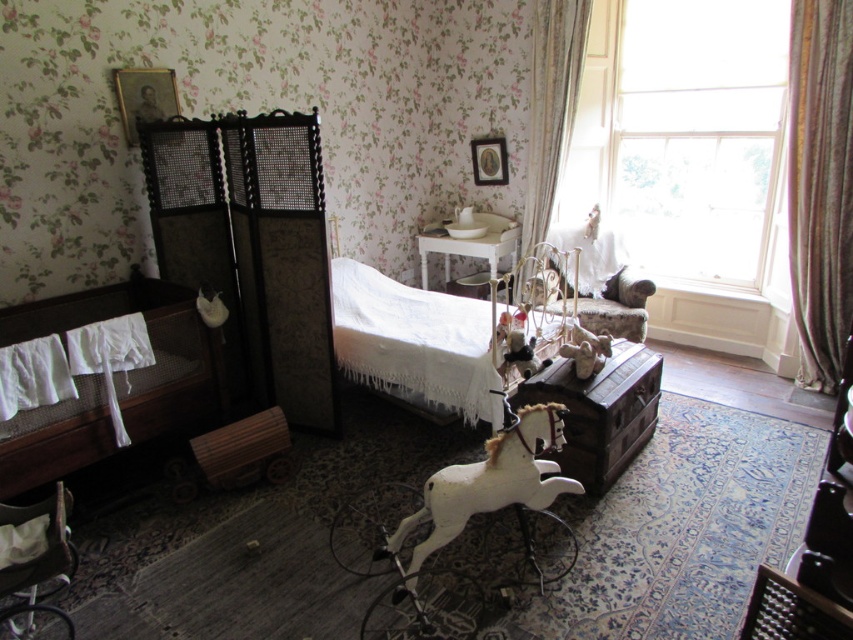
You are standing in the vintage bedroom and want to move from the wooden rocking horse to the dark wooden crib. The room has two points marked as point (714, 116) and point (56, 563). Which point is closer to you as you move towards the crib?

Point (714, 116) is further to the camera than point (56, 563), so the closer point to you as you move towards the crib would be point (56, 563).

You are standing at the point marked as point (45, 556) in the vintage bedroom scene. You want to pick up a small toy that is placed exactly where you are standing. However, there is a wooden rocking horse on a patterned rug in the foreground. Can you reach the toy without moving past the rocking horse?

The point marked as point (45, 556) is 2.19 meters away from you. Since the wooden rocking horse is in the foreground between you and the toy, you would need to move around or past the rocking horse to reach the toy, which is 2.19 meters away from your current position.

You are a parent trying to place a new toy in the room. The toy is 1.2 meters wide. You want to put it between the white plastic baby carriage at lower left and the white glossy table at center. Can the toy fit in that space?

The space between the white plastic baby carriage at lower left and the white glossy table at center is not specified in the provided information. Therefore, it is uncertain whether the toy will fit. Please check the actual distance before placing the toy.